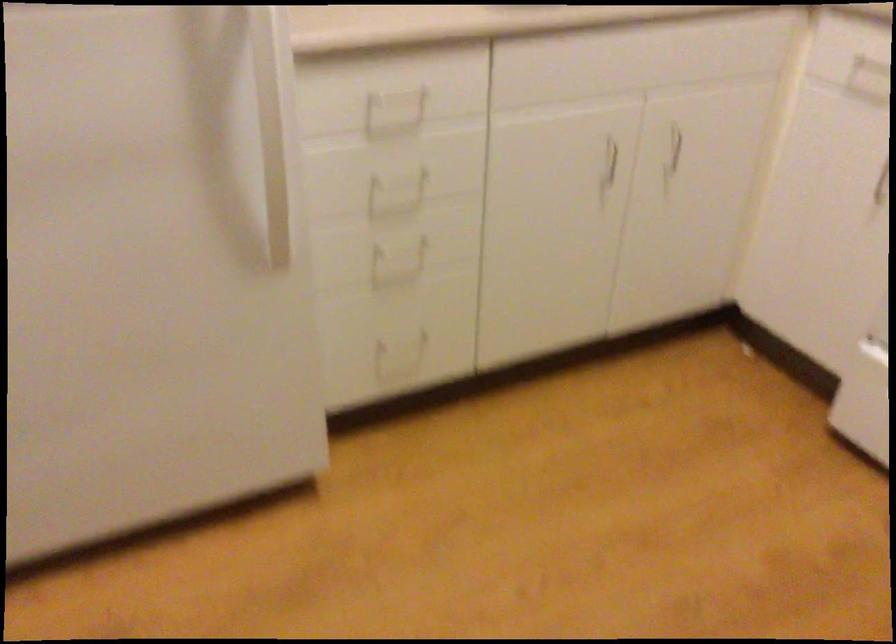
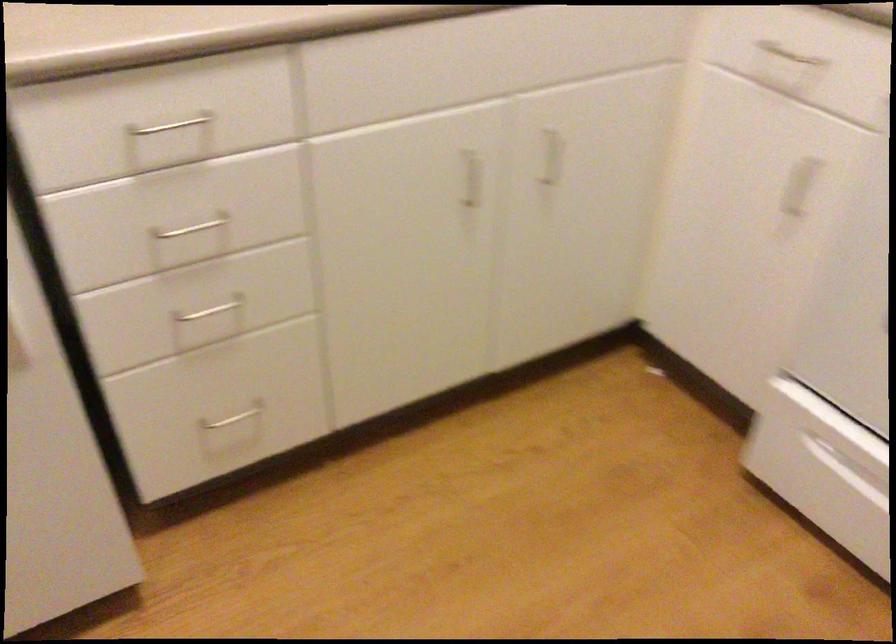
Locate, in the second image, the point that corresponds to [674,143] in the first image.

(552, 156)